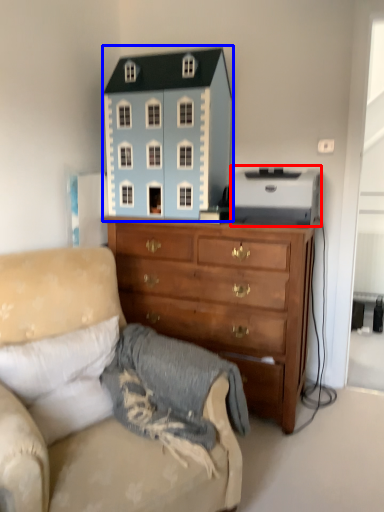
Question: Which of the following is the farthest to the observer, toy (highlighted by a red box) or toy (highlighted by a blue box)?

Choices:
 (A) toy
 (B) toy

Answer: (B)